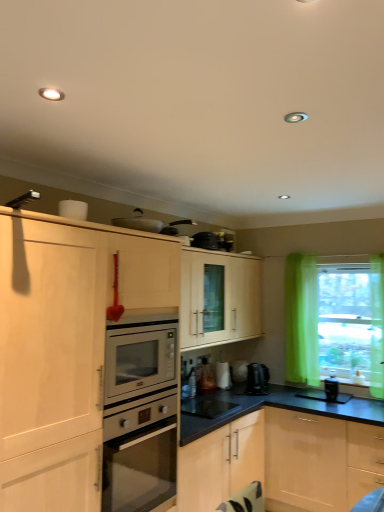
Measure the distance between point [151,223] and camera.

The depth of point [151,223] is 3.14 meters.

Find the location of `white glossy kettle at lower center, which appears as the 3th appliance when viewed from the left`. white glossy kettle at lower center, which appears as the 3th appliance when viewed from the left is located at coordinates (223, 375).

Image resolution: width=384 pixels, height=512 pixels. Describe the element at coordinates (223, 375) in the screenshot. I see `white glossy kettle at lower center, which appears as the 3th appliance when viewed from the left` at that location.

The width and height of the screenshot is (384, 512). What do you see at coordinates (257, 379) in the screenshot?
I see `satin black coffee machine at lower center` at bounding box center [257, 379].

This screenshot has width=384, height=512. In order to click on translucent green curtain at right in this screenshot , I will do `click(335, 321)`.

Considering the positions of objects metallic silver toaster at upper center, the first appliance positioned from the left, and white glossy kettle at lower center, which ranks as the third appliance in bottom-to-top order, in the image provided, who is in front, metallic silver toaster at upper center, the first appliance positioned from the left, or white glossy kettle at lower center, which ranks as the third appliance in bottom-to-top order,?

metallic silver toaster at upper center, the first appliance positioned from the left.

Considering the sizes of objects metallic silver toaster at upper center, the first appliance viewed from the front, and white glossy kettle at lower center, arranged as the 1th appliance when viewed from the back, in the image provided, who is shorter, metallic silver toaster at upper center, the first appliance viewed from the front, or white glossy kettle at lower center, arranged as the 1th appliance when viewed from the back,?

Standing shorter between the two is metallic silver toaster at upper center, the first appliance viewed from the front.

Choose the correct answer: Is metallic silver toaster at upper center, which is the fourth appliance from right to left, inside white glossy kettle at lower center, arranged as the 1th appliance when viewed from the back, or outside it?

metallic silver toaster at upper center, which is the fourth appliance from right to left, is not enclosed by white glossy kettle at lower center, arranged as the 1th appliance when viewed from the back.

Are black plastic coffee maker at lower right, acting as the 3th appliance starting from the front, and metallic silver toaster at upper center, which appears as the 4th appliance when viewed from the back, making contact?

black plastic coffee maker at lower right, acting as the 3th appliance starting from the front, and metallic silver toaster at upper center, which appears as the 4th appliance when viewed from the back, are not in contact.

Which is correct: black plastic coffee maker at lower right, acting as the 3th appliance starting from the front, is inside metallic silver toaster at upper center, which is the fourth appliance from right to left, or outside of it?

black plastic coffee maker at lower right, acting as the 3th appliance starting from the front, is spatially situated outside metallic silver toaster at upper center, which is the fourth appliance from right to left.

Which is more to the right, black plastic coffee maker at lower right, the 3th appliance positioned from the top, or metallic silver toaster at upper center, the first appliance positioned from the left?

Positioned to the right is black plastic coffee maker at lower right, the 3th appliance positioned from the top.

How distant is black plastic coffee maker at lower right, placed as the second appliance when sorted from bottom to top, from metallic silver toaster at upper center, the 4th appliance positioned from the bottom?

black plastic coffee maker at lower right, placed as the second appliance when sorted from bottom to top, is 2.08 meters from metallic silver toaster at upper center, the 4th appliance positioned from the bottom.

Can you confirm if black plastic coffee maker at lower right, placed as the second appliance when sorted from bottom to top, is taller than satin black coffee machine at lower center?

Incorrect, the height of black plastic coffee maker at lower right, placed as the second appliance when sorted from bottom to top, is not larger of that of satin black coffee machine at lower center.

Is black plastic coffee maker at lower right, placed as the second appliance when sorted from bottom to top, aimed at satin black coffee machine at lower center?

No, black plastic coffee maker at lower right, placed as the second appliance when sorted from bottom to top, does not turn towards satin black coffee machine at lower center.

From the image's perspective, is black plastic coffee maker at lower right, placed as the second appliance when sorted from bottom to top, located above or below satin black coffee machine at lower center?

Clearly, from the image's perspective, black plastic coffee maker at lower right, placed as the second appliance when sorted from bottom to top, is below satin black coffee machine at lower center.

Which point is more forward, (x=334, y=397) or (x=258, y=376)?

The point (x=334, y=397) is more forward.

From the image's perspective, between translucent green curtain at right and black plastic coffee maker at lower right, arranged as the 1th appliance when viewed from the right, which one is located above?

translucent green curtain at right is shown above in the image.

Would you say translucent green curtain at right is inside or outside black plastic coffee maker at lower right, arranged as the 1th appliance when viewed from the right?

translucent green curtain at right is outside black plastic coffee maker at lower right, arranged as the 1th appliance when viewed from the right.

Considering the sizes of objects translucent green curtain at right and black plastic coffee maker at lower right, acting as the 3th appliance starting from the front, in the image provided, who is bigger, translucent green curtain at right or black plastic coffee maker at lower right, acting as the 3th appliance starting from the front,?

With larger size is translucent green curtain at right.

In terms of height, does black glossy microwave at center, the 2th appliance when ordered from front to back, look taller or shorter compared to metallic silver toaster at upper center, the 4th appliance positioned from the bottom?

black glossy microwave at center, the 2th appliance when ordered from front to back, is shorter than metallic silver toaster at upper center, the 4th appliance positioned from the bottom.

From a real-world perspective, which is physically below, black glossy microwave at center, arranged as the 4th appliance when viewed from the top, or metallic silver toaster at upper center, the first appliance positioned from the left?

In real-world perspective, black glossy microwave at center, arranged as the 4th appliance when viewed from the top, is lower.

Which of these two, black glossy microwave at center, the 2th appliance when ordered from front to back, or metallic silver toaster at upper center, the first appliance positioned from the left, is bigger?

Bigger between the two is metallic silver toaster at upper center, the first appliance positioned from the left.

Is white glossy kettle at lower center, arranged as the 1th appliance when viewed from the back, at the back of black glossy microwave at center, the 2th appliance when ordered from front to back?

No, white glossy kettle at lower center, arranged as the 1th appliance when viewed from the back, is not at the back of black glossy microwave at center, the 2th appliance when ordered from front to back.

Is the position of black glossy microwave at center, the 2th appliance when ordered from front to back, more distant than that of white glossy kettle at lower center, which ranks as the third appliance in bottom-to-top order?

No, it is in front of white glossy kettle at lower center, which ranks as the third appliance in bottom-to-top order.

From a real-world perspective, is black glossy microwave at center, positioned as the 2th appliance in left-to-right order, beneath white glossy kettle at lower center, which ranks as the fourth appliance in front-to-back order?

Yes, from a real-world perspective, black glossy microwave at center, positioned as the 2th appliance in left-to-right order, is beneath white glossy kettle at lower center, which ranks as the fourth appliance in front-to-back order.

Is point (210, 408) closer or farther from the camera than point (229, 386)?

Point (210, 408).

Is metallic silver toaster at upper center, which is the fourth appliance from right to left, completely or partially outside of translucent green curtain at right?

Yes, metallic silver toaster at upper center, which is the fourth appliance from right to left, is located beyond the bounds of translucent green curtain at right.

Is metallic silver toaster at upper center, the first appliance when ordered from top to bottom, in contact with translucent green curtain at right?

metallic silver toaster at upper center, the first appliance when ordered from top to bottom, and translucent green curtain at right are clearly separated.

From a real-world perspective, is metallic silver toaster at upper center, which appears as the 4th appliance when viewed from the back, located higher than translucent green curtain at right?

Correct, in the physical world, metallic silver toaster at upper center, which appears as the 4th appliance when viewed from the back, is higher than translucent green curtain at right.

Based on the photo, which object is closer to the camera, metallic silver toaster at upper center, which appears as the 4th appliance when viewed from the back, or translucent green curtain at right?

metallic silver toaster at upper center, which appears as the 4th appliance when viewed from the back, is more forward.

Locate an element on the screen. Image resolution: width=384 pixels, height=512 pixels. the 2nd appliance to the left of the white glossy kettle at lower center, which appears as the 3th appliance when viewed from the left, counting from the anchor's position is located at coordinates (138, 222).

Find the location of `appliance that is the 2nd object directly below the metallic silver toaster at upper center, the first appliance positioned from the left (from a real-world perspective)`. appliance that is the 2nd object directly below the metallic silver toaster at upper center, the first appliance positioned from the left (from a real-world perspective) is located at coordinates (331, 387).

From the image, which object appears to be farther from metallic silver toaster at upper center, which appears as the 4th appliance when viewed from the back, white glossy kettle at lower center, acting as the second appliance starting from the top, or satin black coffee machine at lower center?

Based on the image, satin black coffee machine at lower center appears to be further to metallic silver toaster at upper center, which appears as the 4th appliance when viewed from the back.

Which object lies nearer to the anchor point black glossy microwave at center, which is the first appliance in bottom-to-top order, black plastic coffee maker at lower right, acting as the 3th appliance starting from the front, or satin black coffee machine at lower center?

satin black coffee machine at lower center is positioned closer to the anchor black glossy microwave at center, which is the first appliance in bottom-to-top order.

In the scene shown: Looking at the image, which one is located closer to black plastic coffee maker at lower right, the 3th appliance positioned from the top, satin black coffee machine at lower center or white glossy kettle at lower center, arranged as the 1th appliance when viewed from the back?

Among the two, satin black coffee machine at lower center is located nearer to black plastic coffee maker at lower right, the 3th appliance positioned from the top.

Looking at the image, which one is located closer to black glossy microwave at center, the 2th appliance when ordered from front to back, translucent green curtain at right or black plastic coffee maker at lower right, which is the fourth appliance in left-to-right order?

black plastic coffee maker at lower right, which is the fourth appliance in left-to-right order, is positioned closer to the anchor black glossy microwave at center, the 2th appliance when ordered from front to back.

When comparing their distances from black glossy microwave at center, the 2th appliance when ordered from front to back, does metallic silver toaster at upper center, which is the fourth appliance from right to left, or translucent green curtain at right seem closer?

Among the two, translucent green curtain at right is located nearer to black glossy microwave at center, the 2th appliance when ordered from front to back.

Based on their spatial positions, is satin black coffee machine at lower center or black plastic coffee maker at lower right, the 3th appliance positioned from the top, further from translucent green curtain at right?

The object further to translucent green curtain at right is satin black coffee machine at lower center.

Looking at the image, which one is located closer to translucent green curtain at right, black glossy microwave at center, which is the first appliance in bottom-to-top order, or white glossy kettle at lower center, acting as the second appliance starting from the top?

white glossy kettle at lower center, acting as the second appliance starting from the top, lies closer to translucent green curtain at right than the other object.

Looking at the image, which one is located closer to black glossy microwave at center, which is the first appliance in bottom-to-top order, metallic silver toaster at upper center, the first appliance viewed from the front, or satin black coffee machine at lower center?

satin black coffee machine at lower center lies closer to black glossy microwave at center, which is the first appliance in bottom-to-top order, than the other object.

Identify the location of coffee machine located between white glossy kettle at lower center, arranged as the 1th appliance when viewed from the back, and black plastic coffee maker at lower right, arranged as the 1th appliance when viewed from the right, in the left-right direction. (257, 379).

Locate an element on the screen. coffee machine between metallic silver toaster at upper center, which appears as the 4th appliance when viewed from the back, and black glossy microwave at center, which is the first appliance in bottom-to-top order, from top to bottom is located at coordinates (257, 379).

In order to click on coffee machine between metallic silver toaster at upper center, which appears as the 4th appliance when viewed from the back, and translucent green curtain at right from left to right in this screenshot , I will do `click(257, 379)`.

Locate an element on the screen. This screenshot has width=384, height=512. coffee machine between black glossy microwave at center, placed as the third appliance when sorted from back to front, and black plastic coffee maker at lower right, arranged as the 1th appliance when viewed from the right, in the horizontal direction is located at coordinates (257, 379).